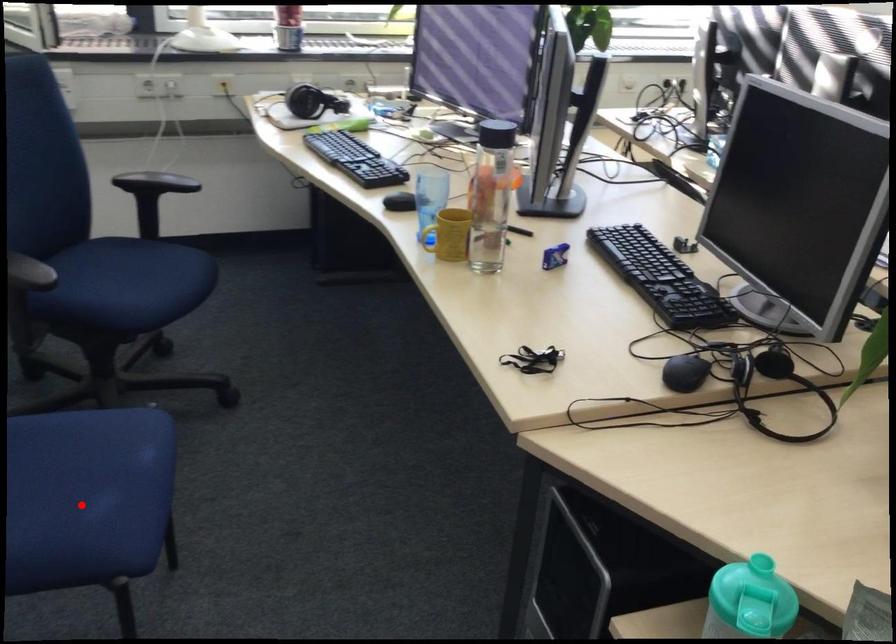
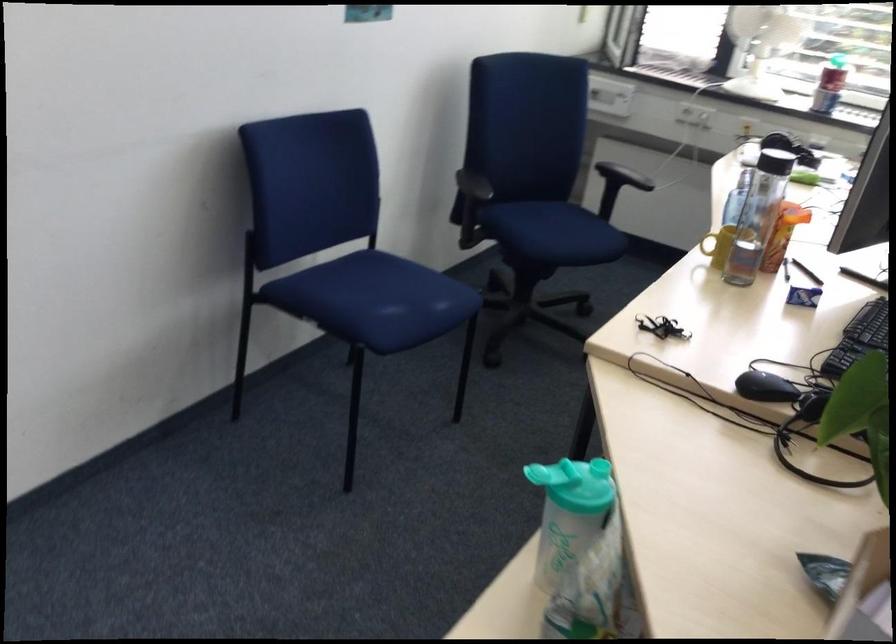
Locate, in the second image, the point that corresponds to the highlighted location in the first image.

(374, 299)